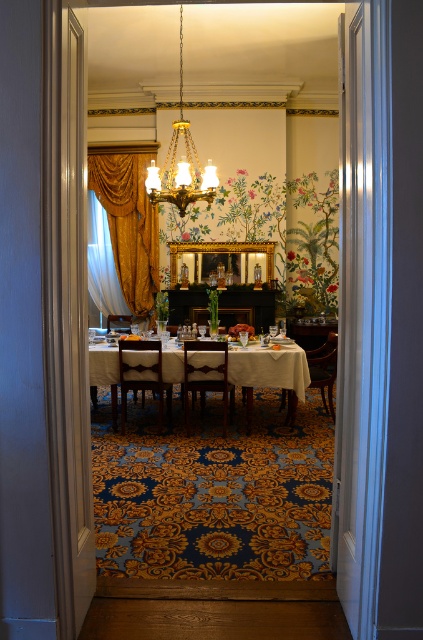
Does gold velvet curtain at left have a lesser width compared to wooden chair at center?

No, gold velvet curtain at left is not thinner than wooden chair at center.

Measure the distance between gold velvet curtain at left and wooden chair at center.

2.80 meters

Between point (87, 173) and point (143, 380), which one is positioned behind?

The point (87, 173) is more distant.

What are the coordinates of `gold velvet curtain at left` in the screenshot? It's located at (x=128, y=220).

Is gold velvet curtain at left to the right of mahogany wood chair at right from the viewer's perspective?

In fact, gold velvet curtain at left is to the left of mahogany wood chair at right.

Is point (114, 212) behind point (332, 340)?

Yes, it is.

Describe the element at coordinates (128, 220) in the screenshot. I see `gold velvet curtain at left` at that location.

The image size is (423, 640). Identify the location of gold velvet curtain at left. (128, 220).

Which is above, gold metallic chandelier at upper center or white sheer curtain at left?

gold metallic chandelier at upper center is higher up.

Is gold metallic chandelier at upper center bigger than white sheer curtain at left?

Indeed, gold metallic chandelier at upper center has a larger size compared to white sheer curtain at left.

Find the location of a particular element. Image resolution: width=423 pixels, height=640 pixels. gold metallic chandelier at upper center is located at coordinates (181, 163).